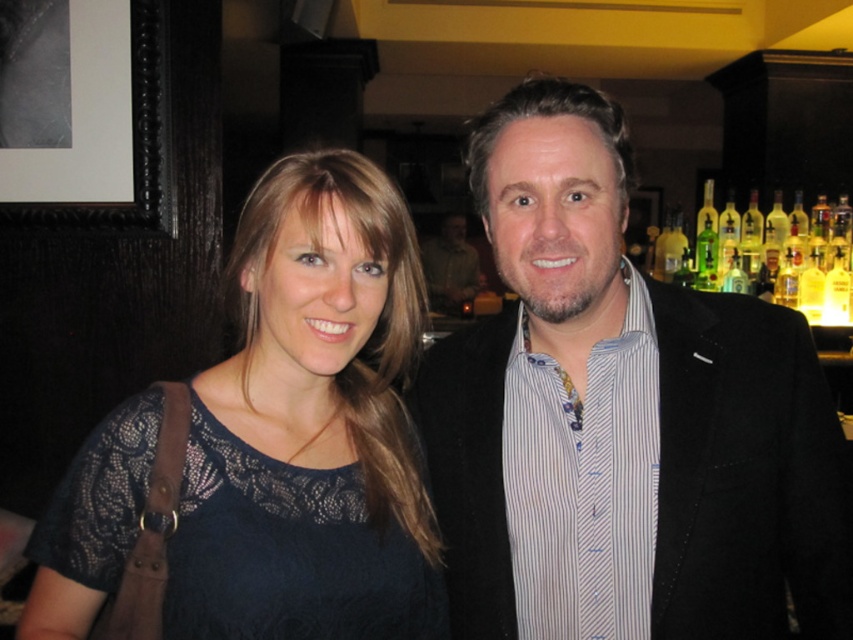
Question: From the image, what is the correct spatial relationship of matte black jacket at center in relation to lace fabric dress at center?

Choices:
 (A) right
 (B) left

Answer: (A)

Question: Does lace fabric dress at center have a lesser width compared to matte black suit at center?

Choices:
 (A) yes
 (B) no

Answer: (A)

Question: Which object is farther from the camera taking this photo?

Choices:
 (A) matte black suit at center
 (B) matte black jacket at center
 (C) translucent glass bottles at right
 (D) lace fabric dress at center

Answer: (A)

Question: Does matte black jacket at center appear under matte black suit at center?

Choices:
 (A) yes
 (B) no

Answer: (A)

Question: Which object is positioned closest to the matte black suit at center?

Choices:
 (A) lace fabric dress at center
 (B) translucent glass bottles at right

Answer: (B)

Question: Which object appears closest to the camera in this image?

Choices:
 (A) matte black jacket at center
 (B) translucent glass bottles at right
 (C) lace fabric dress at center

Answer: (C)